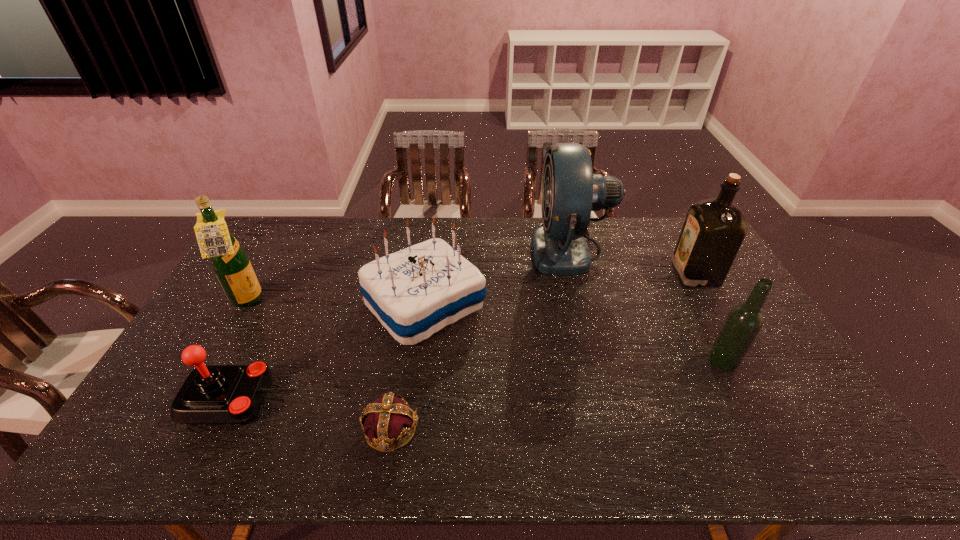
I want to click on free spot at the left edge of the desktop, so 228,345.

I want to click on blank area at the near right corner, so click(838, 466).

You are a GUI agent. You are given a task and a screenshot of the screen. Output one action in this format:
    pyautogui.click(x=<x>, y=<y>)
    Task: Click on the vacant space that's between the fifth object from left to right and the crown
    This screenshot has height=540, width=960.
    Given the screenshot: What is the action you would take?
    pyautogui.click(x=481, y=339)

This screenshot has height=540, width=960. What are the coordinates of `blank region between the fifth object from left to right and the birthday cake` in the screenshot? It's located at (497, 276).

Identify the location of free spot between the fan and the birthday cake. Image resolution: width=960 pixels, height=540 pixels. click(497, 276).

The width and height of the screenshot is (960, 540). I want to click on blank region between the fan and the nearest liquor, so click(646, 305).

Identify the location of vacant region between the birthday cake and the joystick. coord(328,352).

Locate an element on the screen. Image resolution: width=960 pixels, height=540 pixels. vacant area that lies between the birthday cake and the joystick is located at coordinates (328, 352).

Identify the location of object that is the sixth closest to the third object from right to left. The image size is (960, 540). (230, 262).

Select which object is the sixth closest to the birthday cake. Please provide its 2D coordinates. Your answer should be formatted as a tuple, i.e. [(x, y)], where the tuple contains the x and y coordinates of a point satisfying the conditions above.

[(714, 229)]